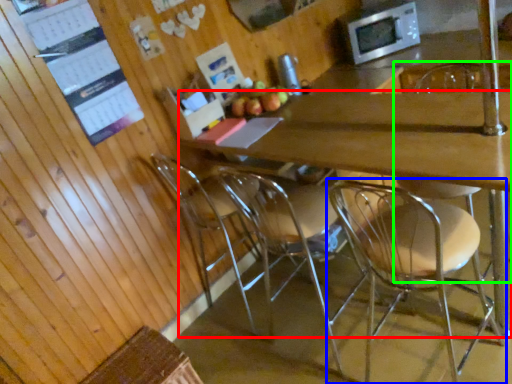
Question: Based on their relative distances, which object is nearer to desk (highlighted by a red box)? Choose from chair (highlighted by a blue box) and chair (highlighted by a green box).

Choices:
 (A) chair
 (B) chair

Answer: (A)